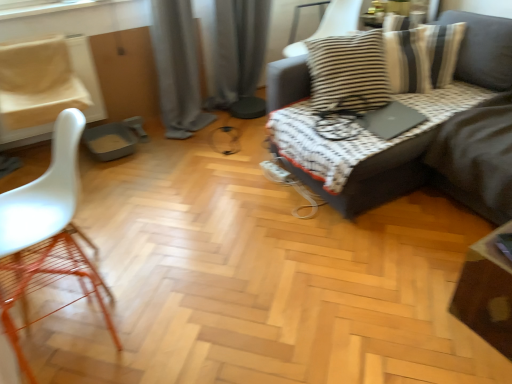
Locate an element on the screen. The width and height of the screenshot is (512, 384). black matte laptop at upper right is located at coordinates (391, 120).

This screenshot has height=384, width=512. Describe the element at coordinates (391, 120) in the screenshot. I see `black matte laptop at upper right` at that location.

What is the approximate width of gray fabric curtain at center, which is the second curtain from right to left?

gray fabric curtain at center, which is the second curtain from right to left, is 41.50 centimeters in width.

The image size is (512, 384). Describe the element at coordinates (378, 177) in the screenshot. I see `dark gray fabric couch at upper right` at that location.

What do you see at coordinates (239, 55) in the screenshot? I see `gray fabric curtain at center, the 1th curtain positioned from the right` at bounding box center [239, 55].

Measure the distance between point (498, 337) and camera.

A distance of 1.62 meters exists between point (498, 337) and camera.

Describe the element at coordinates (486, 292) in the screenshot. I see `wooden table at lower right` at that location.

You are a GUI agent. You are given a task and a screenshot of the screen. Output one action in this format:
    pyautogui.click(x=<x>, y=<y>)
    Task: Click on the white plastic chair at left, the 3th chair positioned from the right
    This screenshot has width=512, height=384.
    Given the screenshot: What is the action you would take?
    pyautogui.click(x=38, y=82)

I want to click on white matte chair at left, positioned as the third chair in back-to-front order, so click(45, 237).

In the scene shown: From a real-world perspective, is wooden table at lower right positioned above or below striped fabric cushion at upper right, the first chair viewed from the top?

In terms of real-world spatial position, wooden table at lower right is below striped fabric cushion at upper right, the first chair viewed from the top.

Measure the distance between wooden table at lower right and striped fabric cushion at upper right, placed as the 3th chair when sorted from left to right.

They are 6.28 feet apart.

From the wooden table at lower right, count the 1st chair to the left and point to it. Please provide its 2D coordinates.

[(339, 19)]

In the scene shown: Is wooden table at lower right aimed at striped fabric cushion at upper right, placed as the 3th chair when sorted from left to right?

No, wooden table at lower right is not turned towards striped fabric cushion at upper right, placed as the 3th chair when sorted from left to right.

Which of these two, gray fabric curtain at center, the 1th curtain positioned from the right, or gray fabric curtain at center, which is the second curtain from right to left, is smaller?

With smaller size is gray fabric curtain at center, the 1th curtain positioned from the right.

Which object is more forward, gray fabric curtain at center, which appears as the second curtain when viewed from the left, or gray fabric curtain at center, the first curtain when ordered from left to right?

gray fabric curtain at center, the first curtain when ordered from left to right, is more forward.

Can you confirm if gray fabric curtain at center, which appears as the second curtain when viewed from the left, is positioned to the left of gray fabric curtain at center, the first curtain when ordered from left to right?

No, gray fabric curtain at center, which appears as the second curtain when viewed from the left, is not to the left of gray fabric curtain at center, the first curtain when ordered from left to right.

From a real-world perspective, is gray fabric curtain at center, which appears as the second curtain when viewed from the left, under gray fabric curtain at center, the first curtain when ordered from left to right?

Correct, in the physical world, gray fabric curtain at center, which appears as the second curtain when viewed from the left, is lower than gray fabric curtain at center, the first curtain when ordered from left to right.

Looking at their sizes, would you say striped fabric cushion at upper right, which is the first chair from right to left, is wider or thinner than gray fabric curtain at center, the 1th curtain positioned from the right?

In the image, striped fabric cushion at upper right, which is the first chair from right to left, appears to be wider than gray fabric curtain at center, the 1th curtain positioned from the right.

Is striped fabric cushion at upper right, the 3th chair when ordered from bottom to top, oriented away from gray fabric curtain at center, the 1th curtain positioned from the right?

striped fabric cushion at upper right, the 3th chair when ordered from bottom to top, does not have its back to gray fabric curtain at center, the 1th curtain positioned from the right.

From the image's perspective, between striped fabric cushion at upper right, placed as the 3th chair when sorted from left to right, and gray fabric curtain at center, which appears as the second curtain when viewed from the left, which one is located above?

striped fabric cushion at upper right, placed as the 3th chair when sorted from left to right, from the image's perspective.

Which object is closer to the camera taking this photo, striped fabric cushion at upper right, which is the first chair from right to left, or gray fabric curtain at center, which appears as the second curtain when viewed from the left?

striped fabric cushion at upper right, which is the first chair from right to left, is more forward.

Considering the positions of objects gray fabric curtain at center, which is the second curtain from right to left, and dark gray fabric couch at upper right in the image provided, who is behind, gray fabric curtain at center, which is the second curtain from right to left, or dark gray fabric couch at upper right?

gray fabric curtain at center, which is the second curtain from right to left, is further away from the camera.

You are a GUI agent. You are given a task and a screenshot of the screen. Output one action in this format:
    pyautogui.click(x=<x>, y=<y>)
    Task: Click on the 1st curtain behind the dark gray fabric couch at upper right, starting your count from the anchor
    The image size is (512, 384).
    Given the screenshot: What is the action you would take?
    pyautogui.click(x=177, y=68)

Is gray fabric curtain at center, which is the second curtain from right to left, thinner than dark gray fabric couch at upper right?

Indeed, gray fabric curtain at center, which is the second curtain from right to left, has a lesser width compared to dark gray fabric couch at upper right.

Does point (183, 87) appear closer or farther from the camera than point (374, 160)?

Point (183, 87).

From their relative heights in the image, would you say white plastic chair at left, which is counted as the second chair, starting from the bottom, is taller or shorter than gray fabric curtain at center, the first curtain when ordered from left to right?

Considering their sizes, white plastic chair at left, which is counted as the second chair, starting from the bottom, has less height than gray fabric curtain at center, the first curtain when ordered from left to right.

The height and width of the screenshot is (384, 512). I want to click on the 1st curtain directly beneath the white plastic chair at left, the second chair viewed from the top (from a real-world perspective), so click(x=177, y=68).

Does white plastic chair at left, positioned as the first chair in left-to-right order, turn towards gray fabric curtain at center, which is the second curtain from right to left?

No, white plastic chair at left, positioned as the first chair in left-to-right order, is not oriented towards gray fabric curtain at center, which is the second curtain from right to left.

Is point (75, 101) closer to viewer compared to point (174, 127)?

Yes, it is in front of point (174, 127).

At what (x,y) coordinates should I click in order to perform the action: click on curtain that is the 2nd object located behind the black matte laptop at upper right. Please return your answer as a coordinate pair (x, y). This screenshot has height=384, width=512. Looking at the image, I should click on (239, 55).

From a real-world perspective, who is located higher, black matte laptop at upper right or gray fabric curtain at center, which appears as the second curtain when viewed from the left?

gray fabric curtain at center, which appears as the second curtain when viewed from the left.

Is black matte laptop at upper right bigger than gray fabric curtain at center, which appears as the second curtain when viewed from the left?

No.

Visually, is gray fabric curtain at center, which appears as the second curtain when viewed from the left, positioned to the left or to the right of wooden table at lower right?

Clearly, gray fabric curtain at center, which appears as the second curtain when viewed from the left, is on the left of wooden table at lower right in the image.

Is point (251, 79) more distant than point (507, 312)?

That is True.

Who is taller, gray fabric curtain at center, the 1th curtain positioned from the right, or wooden table at lower right?

With more height is gray fabric curtain at center, the 1th curtain positioned from the right.

Is the surface of gray fabric curtain at center, the 1th curtain positioned from the right, in direct contact with wooden table at lower right?

No, gray fabric curtain at center, the 1th curtain positioned from the right, is not with wooden table at lower right.

Locate an element on the screen. chair that is the 2nd one when counting backward from the wooden table at lower right is located at coordinates (339, 19).

Where is `curtain that is under the gray fabric curtain at center, which is the second curtain from right to left (from a real-world perspective)`? The width and height of the screenshot is (512, 384). curtain that is under the gray fabric curtain at center, which is the second curtain from right to left (from a real-world perspective) is located at coordinates (239, 55).

Which object lies further to the anchor point wooden table at lower right, gray fabric curtain at center, which appears as the second curtain when viewed from the left, or striped fabric cushion at upper right, arranged as the 3th chair when viewed from the front?

Among the two, gray fabric curtain at center, which appears as the second curtain when viewed from the left, is located further to wooden table at lower right.

Which object lies further to the anchor point white matte chair at left, which is the third chair in top-to-bottom order, wooden table at lower right or gray fabric curtain at center, which is the second curtain from right to left?

The object further to white matte chair at left, which is the third chair in top-to-bottom order, is wooden table at lower right.

From the image, which object appears to be nearer to gray fabric curtain at center, the 1th curtain positioned from the right, white plastic chair at left, the second chair viewed from the top, or gray fabric curtain at center, which is the second curtain from right to left?

gray fabric curtain at center, which is the second curtain from right to left, lies closer to gray fabric curtain at center, the 1th curtain positioned from the right, than the other object.

Looking at this image, based on their spatial positions, is white plastic chair at left, the 3th chair positioned from the right, or gray fabric curtain at center, which appears as the second curtain when viewed from the left, closer to dark gray fabric couch at upper right?

Among the two, gray fabric curtain at center, which appears as the second curtain when viewed from the left, is located nearer to dark gray fabric couch at upper right.

Looking at the image, which one is located closer to white plastic chair at left, positioned as the 2th chair in back-to-front order, white matte chair at left, the first chair positioned from the front, or dark gray fabric couch at upper right?

white matte chair at left, the first chair positioned from the front, is closer to white plastic chair at left, positioned as the 2th chair in back-to-front order.

Based on their spatial positions, is gray fabric curtain at center, the 1th curtain positioned from the right, or white matte chair at left, the first chair positioned from the front, further from wooden table at lower right?

gray fabric curtain at center, the 1th curtain positioned from the right, lies further to wooden table at lower right than the other object.

When comparing their distances from striped fabric cushion at upper right, arranged as the 3th chair when viewed from the front, does white plastic chair at left, positioned as the 2th chair in back-to-front order, or white matte chair at left, marked as the 2th chair in a right-to-left arrangement, seem further?

Among the two, white matte chair at left, marked as the 2th chair in a right-to-left arrangement, is located further to striped fabric cushion at upper right, arranged as the 3th chair when viewed from the front.

From the image, which object appears to be farther from white matte chair at left, marked as the 2th chair in a right-to-left arrangement, black matte laptop at upper right or striped fabric cushion at upper right, which is the first chair from right to left?

striped fabric cushion at upper right, which is the first chair from right to left, lies further to white matte chair at left, marked as the 2th chair in a right-to-left arrangement, than the other object.

Locate an element on the screen. The width and height of the screenshot is (512, 384). chair positioned between white matte chair at left, marked as the 2th chair in a right-to-left arrangement, and gray fabric curtain at center, which is the second curtain from right to left, from near to far is located at coordinates point(38,82).

This screenshot has width=512, height=384. I want to click on chair situated between gray fabric curtain at center, the first curtain when ordered from left to right, and dark gray fabric couch at upper right from left to right, so click(339, 19).

You are a GUI agent. You are given a task and a screenshot of the screen. Output one action in this format:
    pyautogui.click(x=<x>, y=<y>)
    Task: Click on the laptop between white matte chair at left, the first chair positioned from the front, and dark gray fabric couch at upper right, in the horizontal direction
    The image size is (512, 384).
    Given the screenshot: What is the action you would take?
    pyautogui.click(x=391, y=120)

At what (x,y) coordinates should I click in order to perform the action: click on chair situated between white plastic chair at left, positioned as the 2th chair in back-to-front order, and striped fabric cushion at upper right, the first chair viewed from the top, from left to right. Please return your answer as a coordinate pair (x, y). This screenshot has width=512, height=384. Looking at the image, I should click on (45, 237).